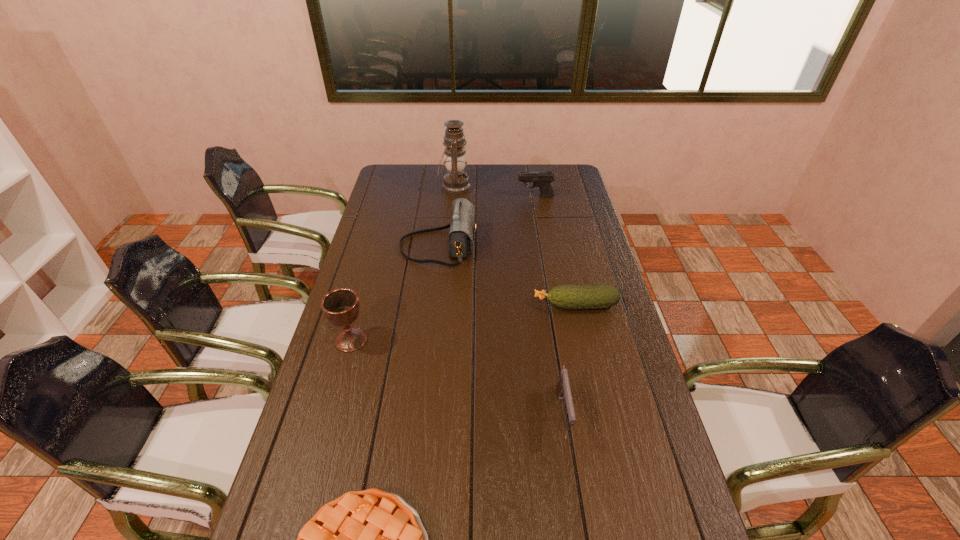
Locate an element on the screen. This screenshot has height=540, width=960. the tallest object is located at coordinates (456, 181).

This screenshot has height=540, width=960. In order to click on the fifth nearest object in this screenshot , I will do `click(462, 229)`.

Image resolution: width=960 pixels, height=540 pixels. In order to click on chalice in this screenshot , I will do `click(340, 306)`.

Identify the location of the farther pistol. (543, 180).

I want to click on the second nearest object, so click(563, 386).

The height and width of the screenshot is (540, 960). What are the coordinates of `the second shortest object` in the screenshot? It's located at (600, 296).

Where is `the fourth farthest object`? The width and height of the screenshot is (960, 540). the fourth farthest object is located at coordinates (600, 296).

The image size is (960, 540). In order to click on free location located on the front of the tallest object in this screenshot , I will do `click(452, 215)`.

The image size is (960, 540). I want to click on blank area located on the right of the third farthest object, so click(528, 247).

Locate an element on the screen. The width and height of the screenshot is (960, 540). blank space located 0.390m on the right of the third nearest object is located at coordinates (494, 340).